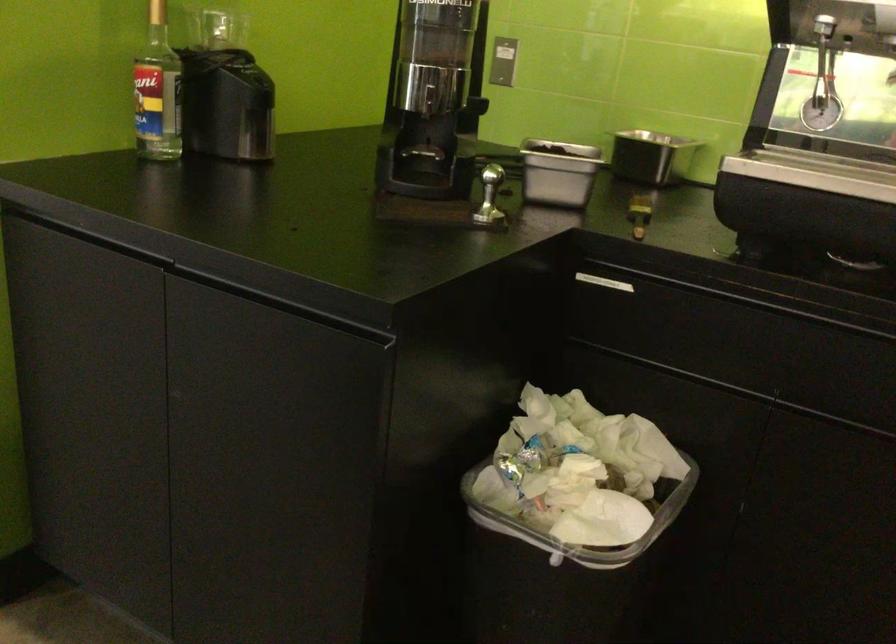
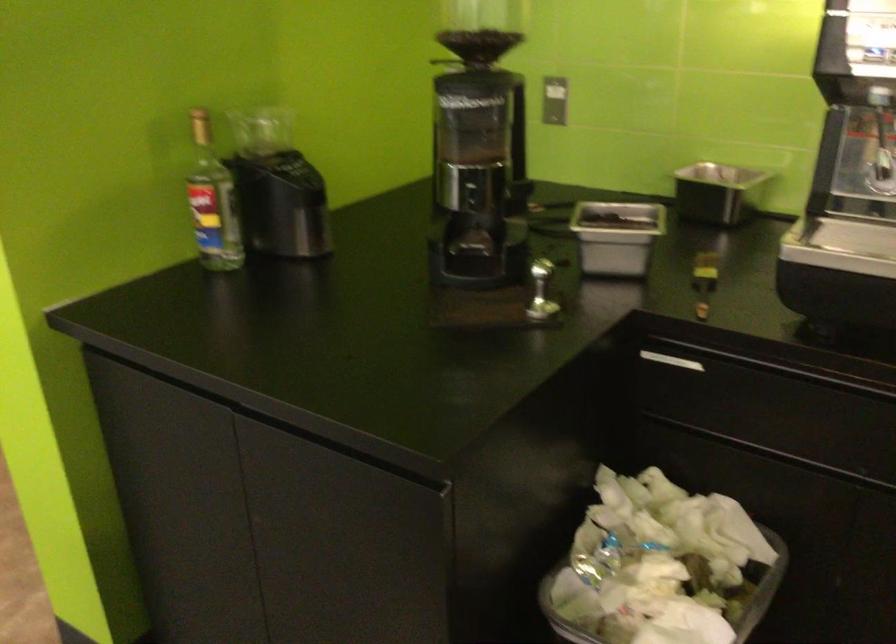
Question: The first image is from the beginning of the video and the second image is from the end. How did the camera likely rotate when shooting the video?

Choices:
 (A) Left
 (B) Right
 (C) Up
 (D) Down

Answer: (A)